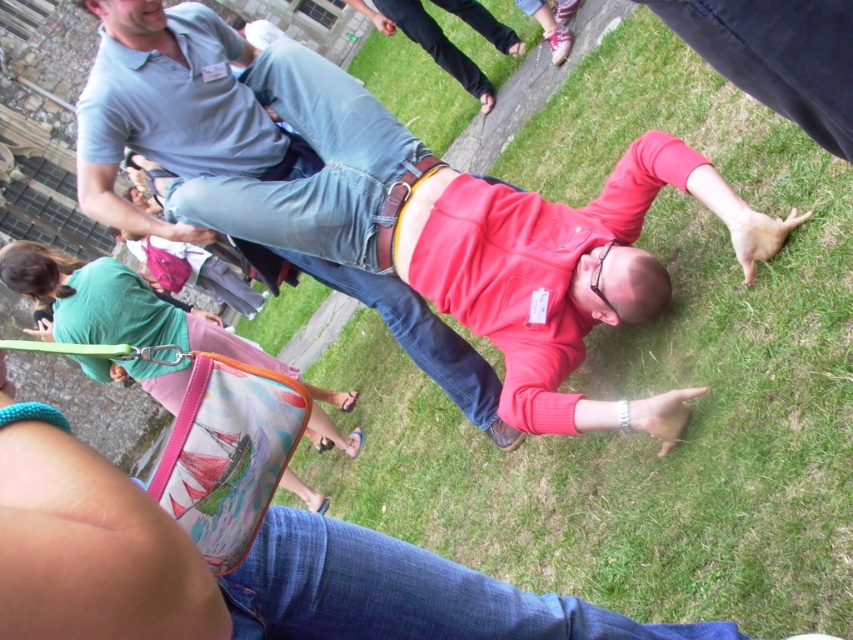
You are a photographer trying to capture a candid shot of the two people in the scene. Which person, the matte red sweater at center or the matte green shirt at lower left, would appear closer to the camera based on their positions?

The matte red sweater at center appears closer to the camera because it is not as tall as the matte green shirt at lower left, indicating it is positioned nearer to the photographer.

You are a drone operator tasked with capturing aerial footage of the scene. The drone has a maximum operational range of 10 meters from its control point. If the control point is located at the matte red sweater at center, can the drone reach the matte green shirt at lower left without exceeding its range?

The distance between the matte red sweater at center and the matte green shirt at lower left is 11.61 meters. Since the drone has a maximum range of 10 meters, it cannot reach the matte green shirt at lower left without exceeding its operational limit.

Consider the image. You are organizing a clothing donation drive and need to sort items by size. You have two items in front of you, the matte red sweater at center and the matte green shirt at lower left. Which one should you place in the large size bin?

The matte green shirt at lower left should be placed in the large size bin because it is larger than the matte red sweater at center.